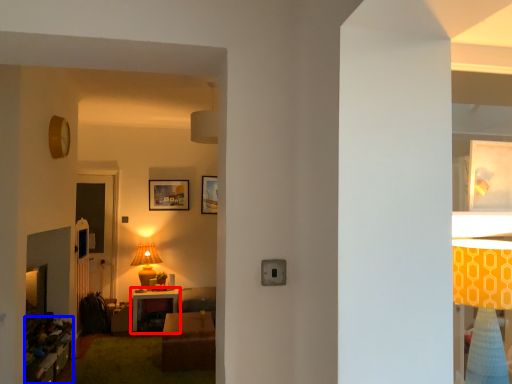
Question: Which of the following is the closest to the observer, table (highlighted by a red box) or dresser (highlighted by a blue box)?

Choices:
 (A) table
 (B) dresser

Answer: (B)